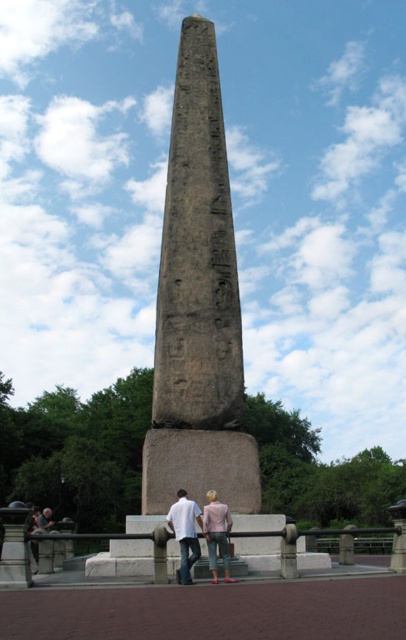
Question: Does granite obelisk at center appear on the right side of pink fabric pants at lower center?

Choices:
 (A) no
 (B) yes

Answer: (A)

Question: Which of the following is the closest to the observer?

Choices:
 (A) (205, 385)
 (B) (196, 513)
 (C) (209, 532)

Answer: (C)

Question: Can you confirm if granite obelisk at center is positioned to the right of pink fabric pants at lower center?

Choices:
 (A) yes
 (B) no

Answer: (B)

Question: Among these objects, which one is farthest from the camera?

Choices:
 (A) pink fabric pants at lower center
 (B) granite obelisk at center

Answer: (B)

Question: Can you confirm if granite obelisk at center is bigger than pink fabric pants at lower center?

Choices:
 (A) yes
 (B) no

Answer: (A)

Question: Which point is closer to the camera?

Choices:
 (A) pink fabric pants at lower center
 (B) granite obelisk at center

Answer: (A)